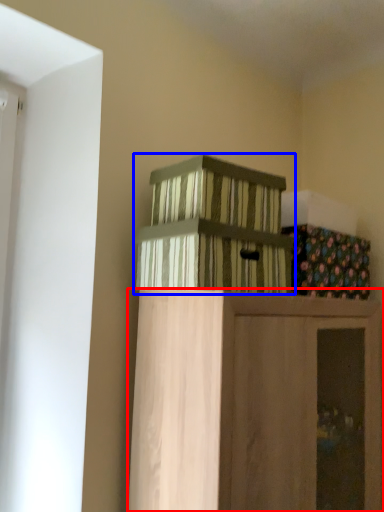
Question: Among these objects, which one is nearest to the camera, furniture (highlighted by a red box) or crate (highlighted by a blue box)?

Choices:
 (A) furniture
 (B) crate

Answer: (A)